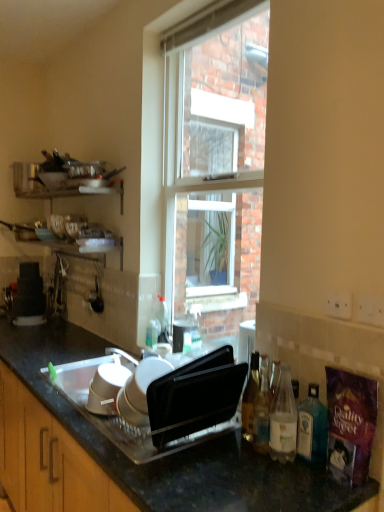
At what (x,y) coordinates should I click in order to perform the action: click on free point above black granite countertop at center (from a real-world perspective). Please return your answer as a coordinate pair (x, y). This screenshot has width=384, height=512. Looking at the image, I should click on (129, 428).